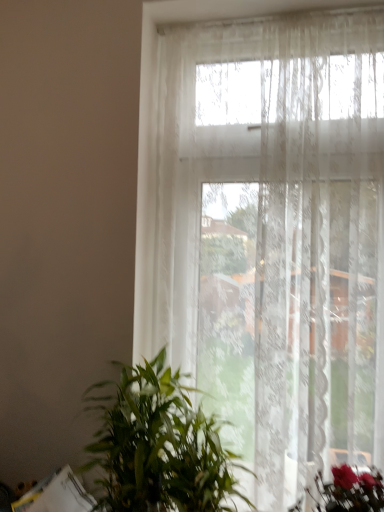
Question: Is point (190, 455) positioned closer to the camera than point (190, 113)?

Choices:
 (A) farther
 (B) closer

Answer: (B)

Question: Do you think green leafy plant at lower left is within transparent lace curtain at upper center, or outside of it?

Choices:
 (A) outside
 (B) inside

Answer: (A)

Question: Is green leafy plant at lower left taller or shorter than transparent lace curtain at upper center?

Choices:
 (A) tall
 (B) short

Answer: (B)

Question: Is transparent lace curtain at upper center in front of or behind green leafy plant at lower left in the image?

Choices:
 (A) behind
 (B) front

Answer: (A)

Question: Visually, is transparent lace curtain at upper center positioned to the left or to the right of green leafy plant at lower left?

Choices:
 (A) right
 (B) left

Answer: (A)

Question: From the image's perspective, is transparent lace curtain at upper center positioned above or below green leafy plant at lower left?

Choices:
 (A) above
 (B) below

Answer: (A)

Question: Considering the positions of transparent lace curtain at upper center and green leafy plant at lower left in the image, is transparent lace curtain at upper center wider or thinner than green leafy plant at lower left?

Choices:
 (A) wide
 (B) thin

Answer: (B)